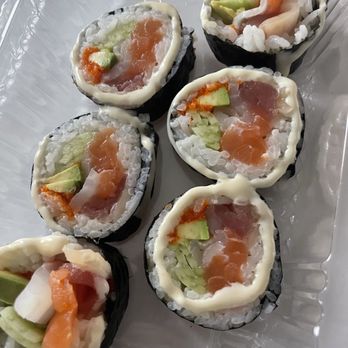
This screenshot has width=348, height=348. I want to click on grey table, so click(336, 305), click(340, 260).